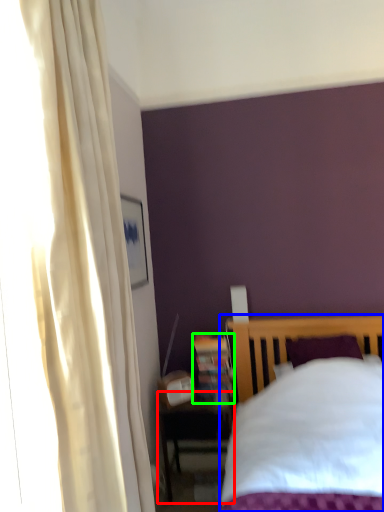
Question: Based on their relative distances, which object is nearer to nightstand (highlighted by a red box)? Choose from bed (highlighted by a blue box) and bookshelf (highlighted by a green box).

Choices:
 (A) bed
 (B) bookshelf

Answer: (B)